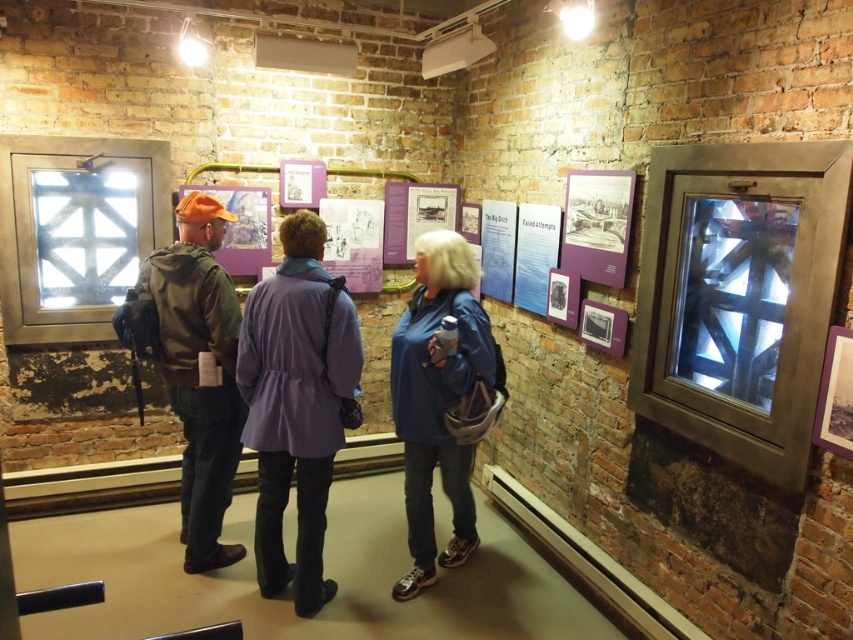
You are standing in the museum and want to take a photo of the point at coordinates (296, 588). If your camera has a focal length of 50mm and you need to be exactly 10 feet away to get the shot, should you move closer or farther away?

The point at coordinates (296, 588) is 9.14 feet away from you. Since you need to be exactly 10 feet away for the shot, you should move slightly farther away to increase the distance to 10 feet.

You are standing at the entrance of the museum and want to take a photo of the two points marked in the scene. The first point is at coordinates point (x=265, y=428) and the second at point (x=223, y=392). Since you want to capture both points in your camera frame, which point should you focus on first to ensure both are in view?

Point (x=265, y=428) is in front of point (x=223, y=392), so you should focus on point (x=265, y=428) first to ensure both points are in view.

You are standing at the point labeled as point (486, 356) in the museum. You want to take a photo of the exhibit located at point (270, 321). Can you directly take the photo without moving, considering your current position?

Point (270, 321) is in front of point (486, 356), so you can directly take the photo without moving because the exhibit is already in front of your current position.